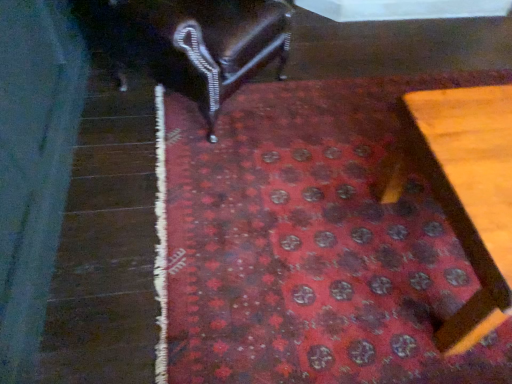
What are the coordinates of `empty space that is ontop of red carpet at center (from a real-world perspective)` in the screenshot? It's located at (322, 208).